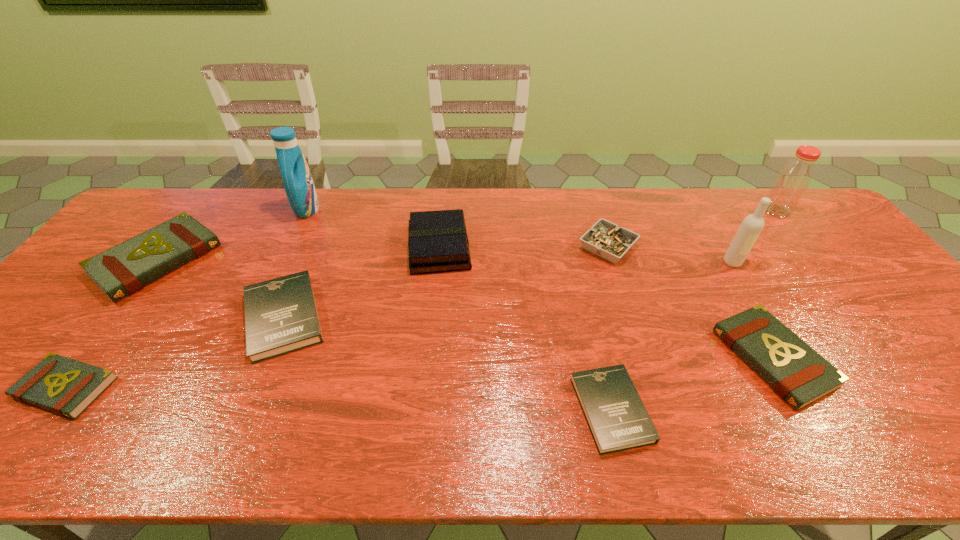
The image size is (960, 540). I want to click on blank area in the image that satisfies the following two spatial constraints: 1. on the front-facing side of the right dark book; 2. on the left side of the detergent, so click(214, 409).

The width and height of the screenshot is (960, 540). Find the location of `free space that satisfies the following two spatial constraints: 1. on the front-facing side of the tallest object; 2. on the right side of the nearer dark book`. free space that satisfies the following two spatial constraints: 1. on the front-facing side of the tallest object; 2. on the right side of the nearer dark book is located at coordinates (214, 409).

You are a GUI agent. You are given a task and a screenshot of the screen. Output one action in this format:
    pyautogui.click(x=<x>, y=<y>)
    Task: Click on the free space in the image that satisfies the following two spatial constraints: 1. on the back side of the vodka; 2. on the left side of the shortest book
    This screenshot has width=960, height=540.
    Given the screenshot: What is the action you would take?
    pyautogui.click(x=578, y=262)

Where is `free space that satisfies the following two spatial constraints: 1. on the back side of the rightmost object; 2. on the left side of the smaller dark book`? The image size is (960, 540). free space that satisfies the following two spatial constraints: 1. on the back side of the rightmost object; 2. on the left side of the smaller dark book is located at coordinates (565, 211).